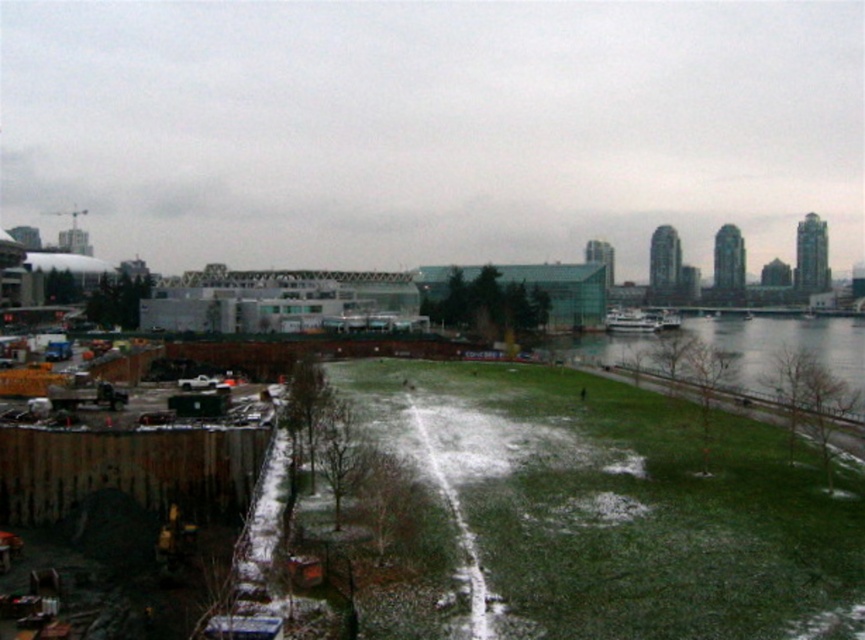
Question: Where is green grass at lower center located in relation to green grass at lower right in the image?

Choices:
 (A) right
 (B) left

Answer: (B)

Question: Which object is closer to the camera taking this photo?

Choices:
 (A) green grass at lower center
 (B) green grass at lower right

Answer: (A)

Question: Can you confirm if green grass at lower center is smaller than green grass at lower right?

Choices:
 (A) yes
 (B) no

Answer: (A)

Question: Is green grass at lower center below green grass at lower right?

Choices:
 (A) no
 (B) yes

Answer: (B)